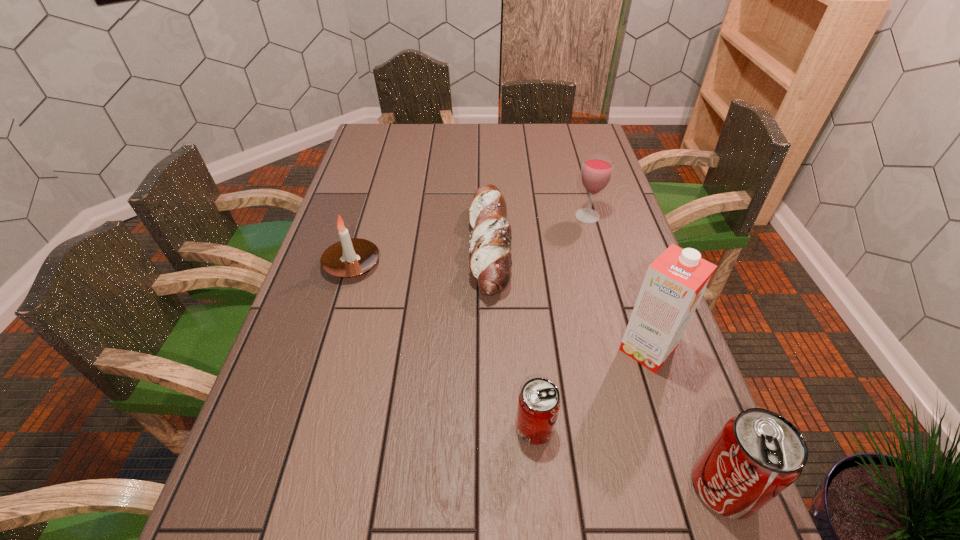
Where is `the shorter pop soda`? the shorter pop soda is located at coordinates 539,402.

Where is `the second shortest object`? the second shortest object is located at coordinates (539, 402).

Find the location of a particular element. the nearest object is located at coordinates (758, 453).

The width and height of the screenshot is (960, 540). Find the location of `the taller pop soda`. the taller pop soda is located at coordinates (758, 453).

Where is `wineglass`? Image resolution: width=960 pixels, height=540 pixels. wineglass is located at coordinates (596, 171).

I want to click on baguet, so click(490, 263).

What are the coordinates of `candle` in the screenshot? It's located at (350, 257).

Image resolution: width=960 pixels, height=540 pixels. Identify the location of the tallest object. (675, 282).

Identify the location of carton. (675, 282).

The image size is (960, 540). Find the location of `vacant region located 0.160m on the back of the second shortest object`. vacant region located 0.160m on the back of the second shortest object is located at coordinates (527, 347).